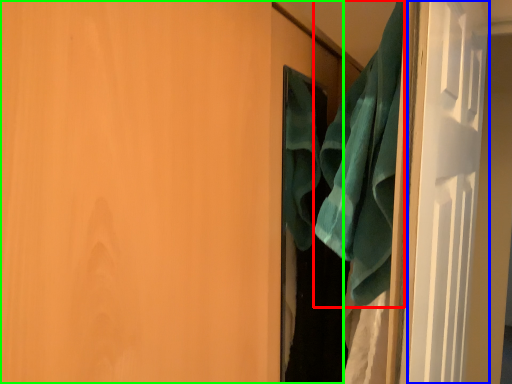
Question: Which object is the farthest from beach towel (highlighted by a red box)? Choose among these: screen door (highlighted by a blue box) or door (highlighted by a green box).

Choices:
 (A) screen door
 (B) door

Answer: (B)